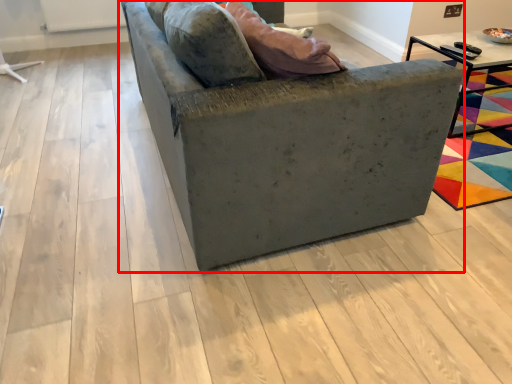
Question: Observing the image, what is the correct spatial positioning of studio couch (annotated by the red box) in reference to table?

Choices:
 (A) right
 (B) left

Answer: (B)